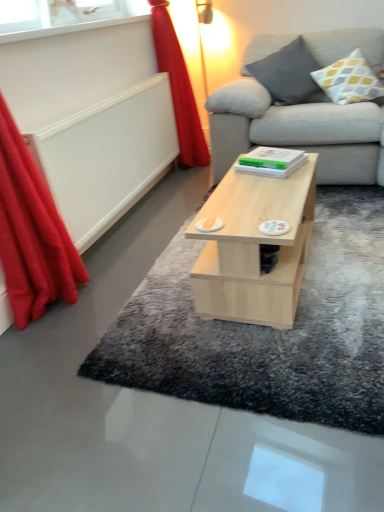
This screenshot has height=512, width=384. What are the coordinates of `vacant region in front of light wood coffee table at center` in the screenshot? It's located at (291, 344).